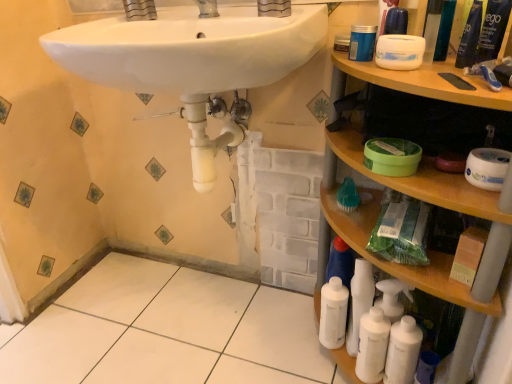
You are a GUI agent. You are given a task and a screenshot of the screen. Output one action in this format:
    pyautogui.click(x=<x>, y=<y>)
    Task: Click on the vacant space in between white matte toothpaste at upper right and white matte container at upper right, placed as the 1th toilet paper when sorted from top to bottom
    The height and width of the screenshot is (384, 512).
    Given the screenshot: What is the action you would take?
    pyautogui.click(x=444, y=75)